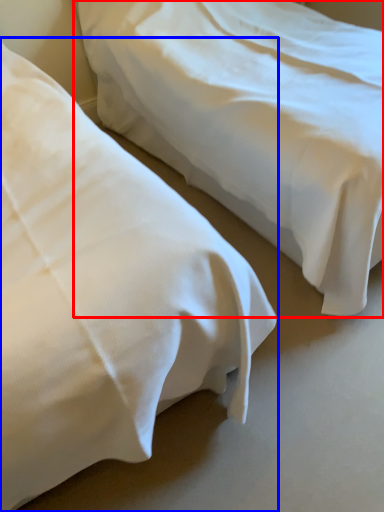
Question: Which point is closer to the camera, bed (highlighted by a red box) or bed (highlighted by a blue box)?

Choices:
 (A) bed
 (B) bed

Answer: (B)